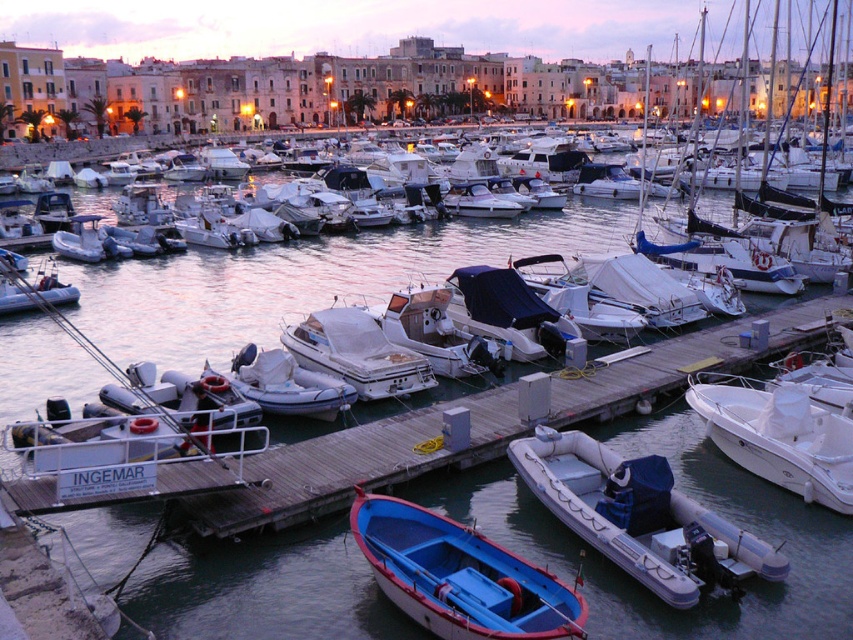
Question: Is wooden dock at center below blue matte rowboat at center?

Choices:
 (A) yes
 (B) no

Answer: (B)

Question: Which point appears closest to the camera in this image?

Choices:
 (A) (553, 484)
 (B) (107, 250)
 (C) (398, 524)
 (D) (233, 520)

Answer: (C)

Question: Is rubber dinghy at lower right smaller than white matte boat at center?

Choices:
 (A) no
 (B) yes

Answer: (A)

Question: Which of the following is the farthest from the observer?

Choices:
 (A) matte white dinghy at left
 (B) rubber dinghy at lower right

Answer: (A)

Question: Is white glossy boat at center to the right of white rubber dinghy at center from the viewer's perspective?

Choices:
 (A) yes
 (B) no

Answer: (A)

Question: Among these objects, which one is farthest from the camera?

Choices:
 (A) rubber dinghy at lower right
 (B) blue matte rowboat at center

Answer: (A)